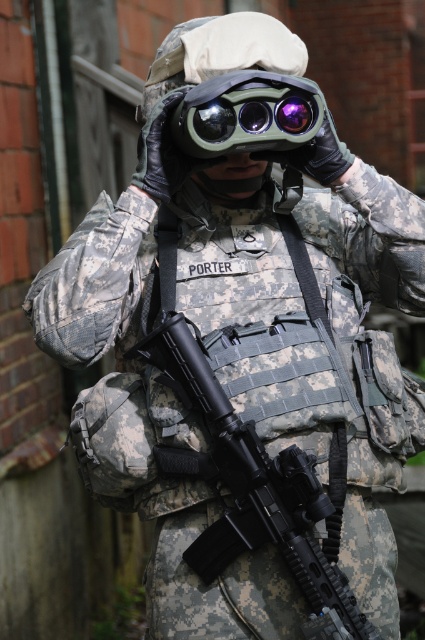
Is black matte rifle at center below green matte binoculars at center?

Yes.

In the scene shown: Can you confirm if black matte rifle at center is smaller than green matte binoculars at center?

Incorrect, black matte rifle at center is not smaller in size than green matte binoculars at center.

Which is behind, point (285, 490) or point (237, 84)?

Positioned behind is point (237, 84).

Find the location of a particular element. The image size is (425, 640). black matte rifle at center is located at coordinates (255, 486).